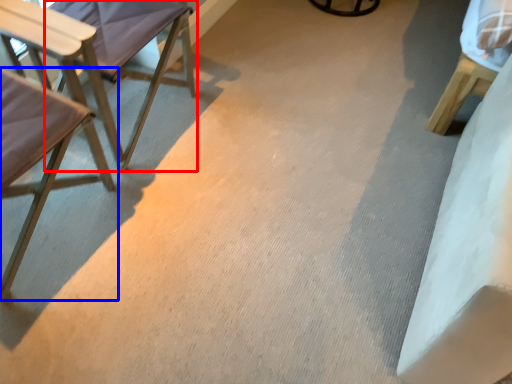
Question: Which object appears closest to the camera in this image, chair (highlighted by a red box) or chair (highlighted by a blue box)?

Choices:
 (A) chair
 (B) chair

Answer: (B)